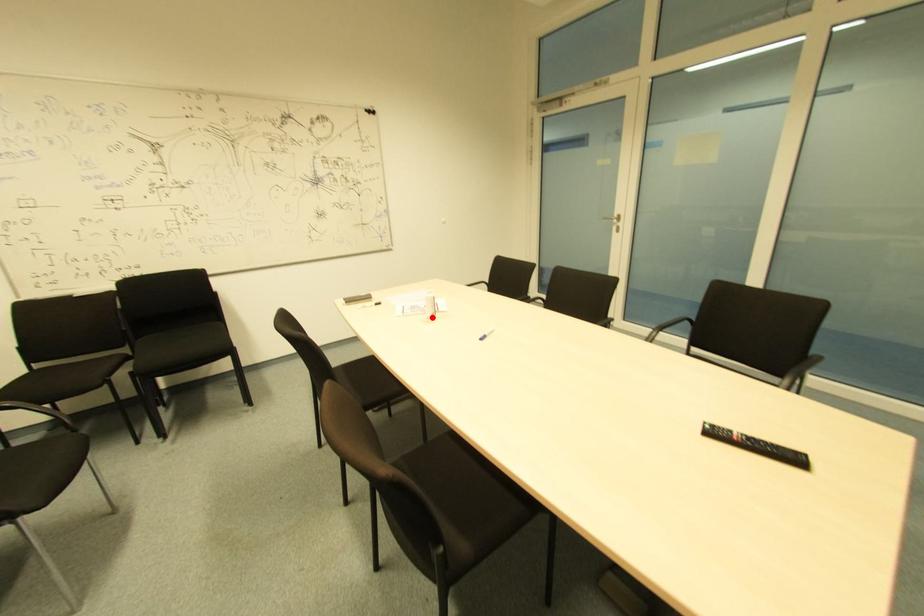
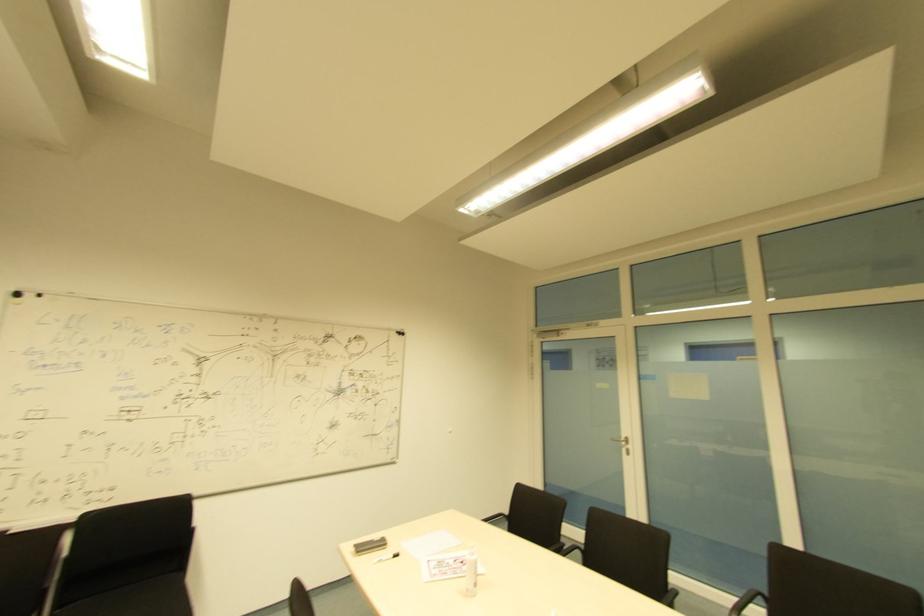
The point at the highlighted location is marked in the first image. Where is the corresponding point in the second image?

(473, 588)